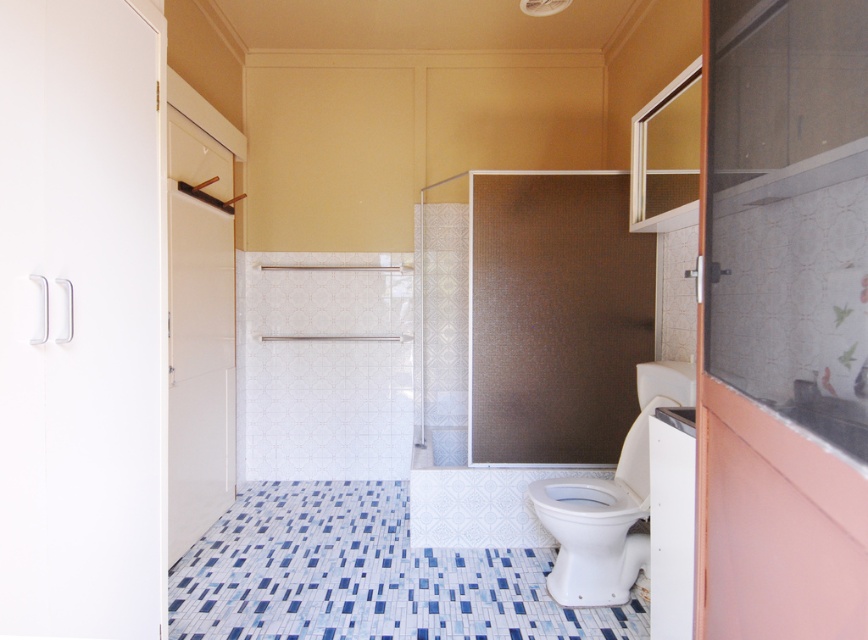
You are standing in the bathroom and want to reach both points. Which point, point (40, 60) or point (235, 604), will you reach first?

You will reach point (40, 60) first because it is closer to you than point (235, 604).